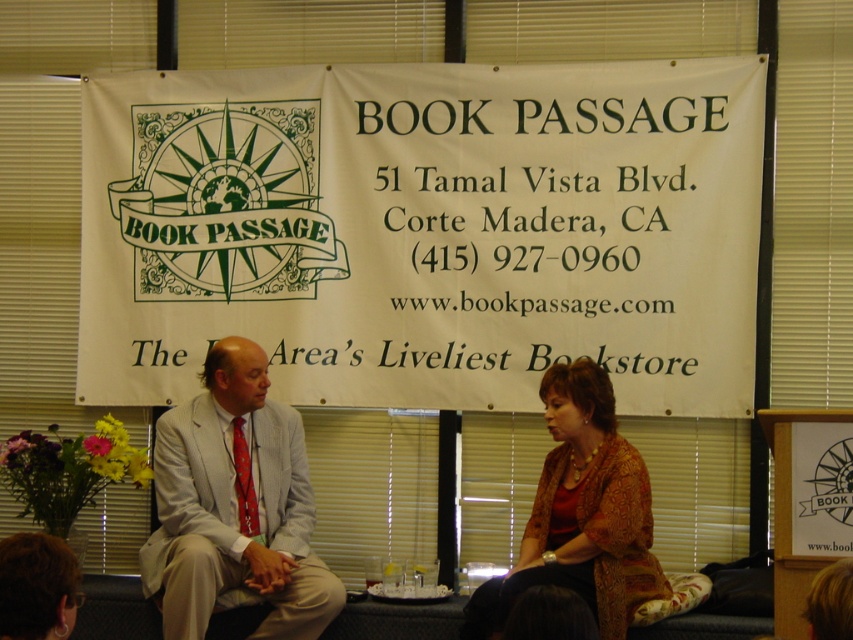
You are attending a book event at Book Passage and notice the white paper banner at upper center and the light gray suit at center. From your perspective at the entrance, which object is positioned to the right of the other?

The white paper banner at upper center is positioned to the right of the light gray suit at center.

You are attending a book signing event at Book Passage. You see two people in the front row wearing a light gray suit at center and a brown textured sweater at center. If you want to approach the person who is closer to you, which one should you go to?

The light gray suit at center is closer to you because it is further to the viewer than the brown textured sweater at center, meaning it is positioned nearer in the image.